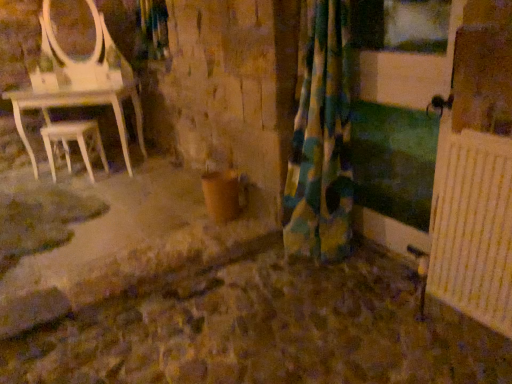
Question: Does white wood stool at left have a lesser width compared to fluffy multicolored curtain at center?

Choices:
 (A) yes
 (B) no

Answer: (A)

Question: Is fluffy multicolored curtain at center at the back of white wood stool at left?

Choices:
 (A) no
 (B) yes

Answer: (A)

Question: From the image's perspective, is white wood stool at left below fluffy multicolored curtain at center?

Choices:
 (A) no
 (B) yes

Answer: (A)

Question: Is fluffy multicolored curtain at center located within white wood stool at left?

Choices:
 (A) no
 (B) yes

Answer: (A)

Question: From a real-world perspective, does white wood stool at left sit lower than fluffy multicolored curtain at center?

Choices:
 (A) no
 (B) yes

Answer: (B)

Question: Does white wood stool at left appear on the left side of fluffy multicolored curtain at center?

Choices:
 (A) no
 (B) yes

Answer: (B)

Question: From the image's perspective, is fluffy multicolored curtain at center over white wood stool at left?

Choices:
 (A) yes
 (B) no

Answer: (B)

Question: Can you confirm if fluffy multicolored curtain at center is positioned to the right of white wood stool at left?

Choices:
 (A) yes
 (B) no

Answer: (A)

Question: Does fluffy multicolored curtain at center have a lesser height compared to white wood stool at left?

Choices:
 (A) no
 (B) yes

Answer: (A)

Question: Does fluffy multicolored curtain at center turn towards white wood stool at left?

Choices:
 (A) yes
 (B) no

Answer: (B)

Question: Is fluffy multicolored curtain at center bigger than white wood stool at left?

Choices:
 (A) yes
 (B) no

Answer: (A)

Question: Considering the relative sizes of fluffy multicolored curtain at center and white wood stool at left in the image provided, is fluffy multicolored curtain at center taller than white wood stool at left?

Choices:
 (A) no
 (B) yes

Answer: (B)

Question: Would you say fluffy multicolored curtain at center is inside or outside white wood stool at left?

Choices:
 (A) inside
 (B) outside

Answer: (B)